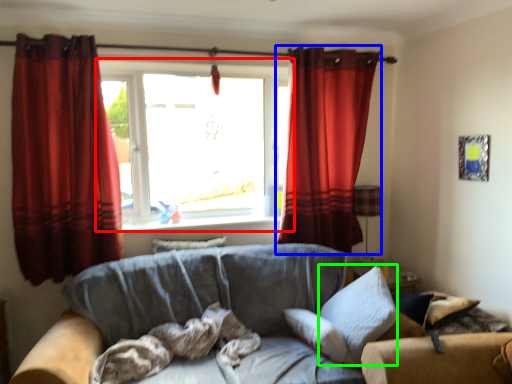
Question: Which object is positioned closest to window (highlighted by a red box)? Select from curtain (highlighted by a blue box) and pillow (highlighted by a green box).

Choices:
 (A) curtain
 (B) pillow

Answer: (A)